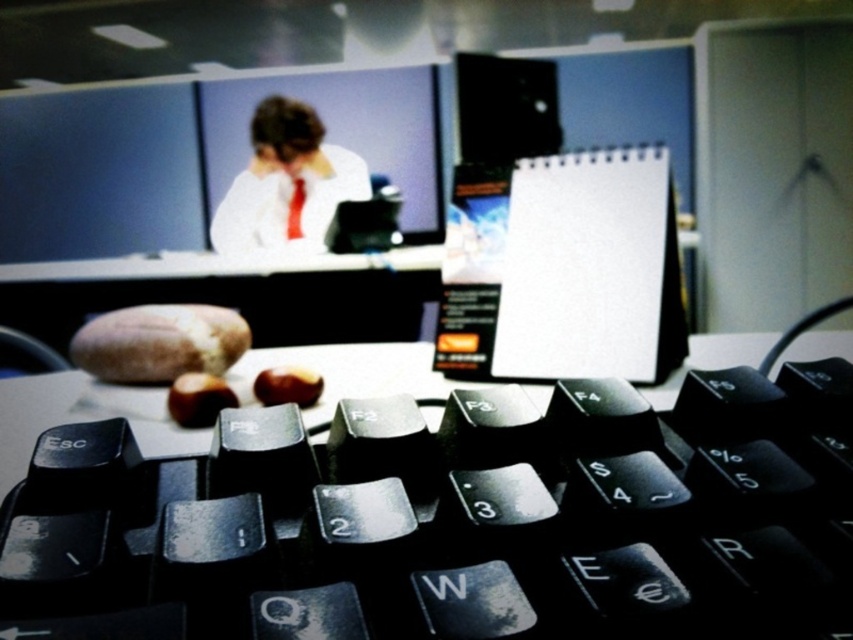
Where is the black plastic keyboard at lower center located in terms of coordinates?

The black plastic keyboard at lower center is located at point coordinates of (453, 518).